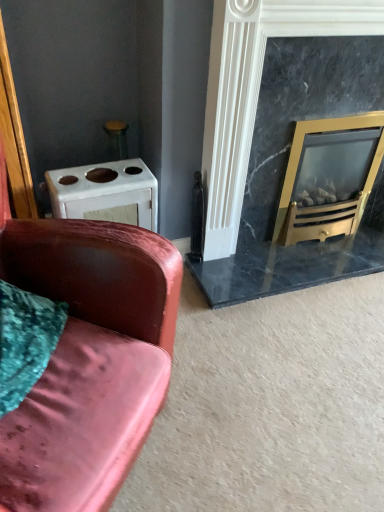
Question: Is gold metallic wood burning stove at right at the back of velvet pink couch at left?

Choices:
 (A) yes
 (B) no

Answer: (B)

Question: Is velvet pink couch at left thinner than gold metallic wood burning stove at right?

Choices:
 (A) yes
 (B) no

Answer: (B)

Question: From the image's perspective, is velvet pink couch at left above gold metallic wood burning stove at right?

Choices:
 (A) no
 (B) yes

Answer: (A)

Question: Is the position of velvet pink couch at left more distant than that of gold metallic wood burning stove at right?

Choices:
 (A) no
 (B) yes

Answer: (A)

Question: Is velvet pink couch at left surrounding gold metallic wood burning stove at right?

Choices:
 (A) yes
 (B) no

Answer: (B)

Question: Can you confirm if velvet pink couch at left is wider than gold metallic wood burning stove at right?

Choices:
 (A) no
 (B) yes

Answer: (B)

Question: Is marble fireplace at right wider than gold metallic wood burning stove at right?

Choices:
 (A) yes
 (B) no

Answer: (B)

Question: Is marble fireplace at right further to camera compared to gold metallic wood burning stove at right?

Choices:
 (A) no
 (B) yes

Answer: (A)

Question: Is gold metallic wood burning stove at right completely or partially inside marble fireplace at right?

Choices:
 (A) yes
 (B) no

Answer: (A)

Question: From a real-world perspective, is marble fireplace at right under gold metallic wood burning stove at right?

Choices:
 (A) no
 (B) yes

Answer: (A)

Question: Considering the relative sizes of marble fireplace at right and gold metallic wood burning stove at right in the image provided, is marble fireplace at right smaller than gold metallic wood burning stove at right?

Choices:
 (A) no
 (B) yes

Answer: (A)

Question: From the image's perspective, is marble fireplace at right located above gold metallic wood burning stove at right?

Choices:
 (A) yes
 (B) no

Answer: (A)

Question: Can you confirm if gold metallic wood burning stove at right is positioned to the left of white matte oven at upper left?

Choices:
 (A) no
 (B) yes

Answer: (A)